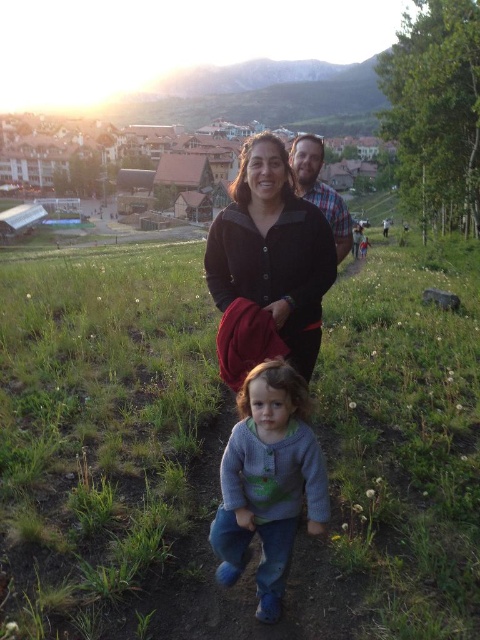
Question: Does green grassy at center appear under plaid shirt at center?

Choices:
 (A) yes
 (B) no

Answer: (A)

Question: Estimate the real-world distances between objects in this image. Which object is closer to the black matte jacket at center?

Choices:
 (A) green grassy at center
 (B) plaid shirt at center

Answer: (B)

Question: Observing the image, what is the correct spatial positioning of green grassy at center in reference to plaid shirt at center?

Choices:
 (A) below
 (B) above

Answer: (A)

Question: Which is farther from the plaid shirt at center?

Choices:
 (A) black matte jacket at center
 (B) knitted sweater at center

Answer: (B)

Question: Does knitted sweater at center appear over black matte jacket at center?

Choices:
 (A) yes
 (B) no

Answer: (B)

Question: Which object is positioned farthest from the knitted sweater at center?

Choices:
 (A) plaid shirt at center
 (B) green grassy at center
 (C) black matte jacket at center

Answer: (B)